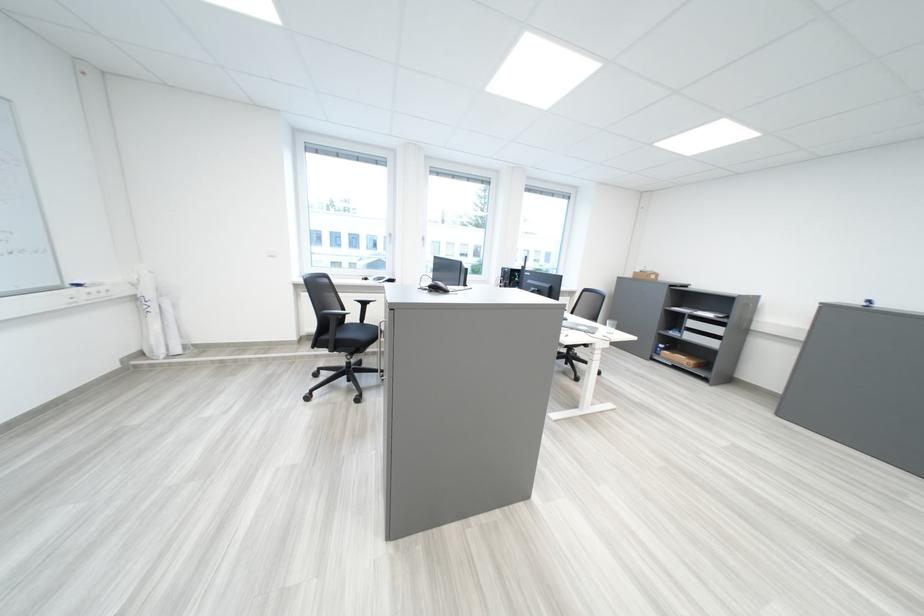
The image size is (924, 616). Identify the location of white window handle. (386, 241).